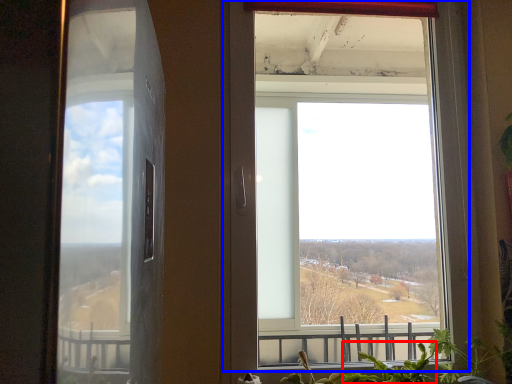
Question: Which object is closer to the camera taking this photo, plant (highlighted by a red box) or window (highlighted by a blue box)?

Choices:
 (A) plant
 (B) window

Answer: (A)